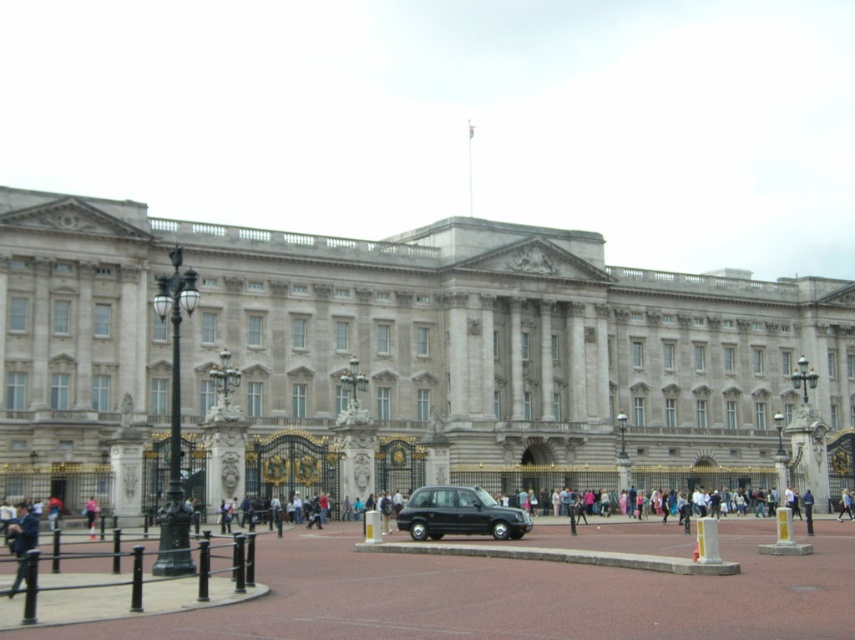
Question: Which point is farther from the camera taking this photo?

Choices:
 (A) (805, 515)
 (B) (841, 508)
 (C) (496, 536)
 (D) (32, 512)

Answer: (B)

Question: Can you confirm if black rubber taxi at center is positioned below light blue fabric jacket at center?

Choices:
 (A) no
 (B) yes

Answer: (A)

Question: Which of the following is the farthest from the observer?

Choices:
 (A) (93, 524)
 (B) (469, 490)
 (C) (847, 500)
 (D) (12, 586)

Answer: (C)

Question: Which point appears farthest from the camera in this image?

Choices:
 (A) (458, 227)
 (B) (419, 502)
 (C) (848, 513)
 (D) (27, 513)

Answer: (A)

Question: Is blue denim jacket at lower right wider than pink fabric at center?

Choices:
 (A) no
 (B) yes

Answer: (B)

Question: Is gray stone palace at center positioned in front of black rubber taxi at center?

Choices:
 (A) yes
 (B) no

Answer: (B)